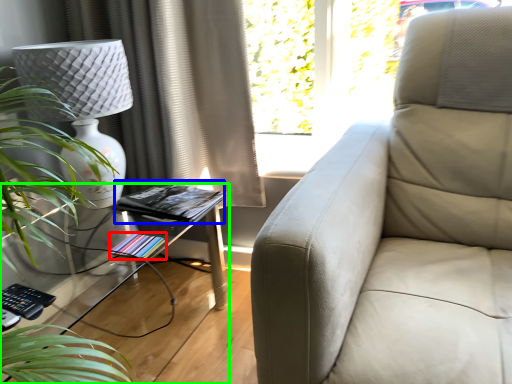
Question: Based on their relative distances, which object is nearer to book (highlighted by a red box)? Choose from book (highlighted by a blue box) and table (highlighted by a green box).

Choices:
 (A) book
 (B) table

Answer: (A)